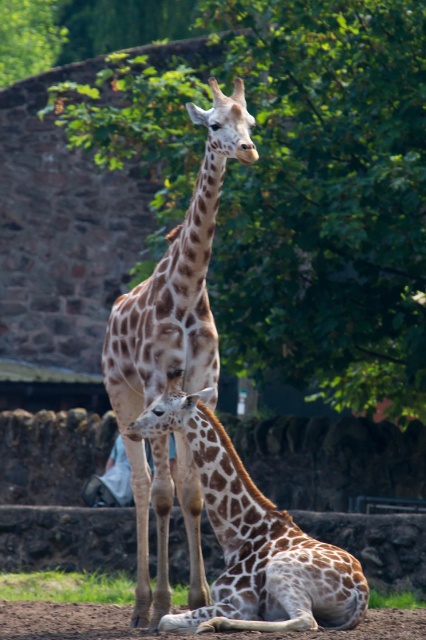
Is green leafy tree at upper center closer to camera compared to brown spotted giraffe at center?

That is False.

Is green leafy tree at upper center positioned behind brown spotted giraffe at center?

Yes, it is.

Identify the location of green leafy tree at upper center. (327, 198).

Looking at this image, does green leafy tree at upper center appear on the right side of spotted fur giraffe at center?

Correct, you'll find green leafy tree at upper center to the right of spotted fur giraffe at center.

Between point (164, 212) and point (143, 620), which one is positioned in front?

Positioned in front is point (143, 620).

Is point (169, 106) in front of point (183, 493)?

No.

The width and height of the screenshot is (426, 640). Identify the location of green leafy tree at upper center. (x=327, y=198).

Based on the photo, who is more forward, (253, 560) or (172, 637)?

Point (172, 637) is more forward.

Describe the element at coordinates (253, 538) in the screenshot. I see `brown spotted giraffe at center` at that location.

Describe the element at coordinates (253, 538) in the screenshot. The width and height of the screenshot is (426, 640). I see `brown spotted giraffe at center` at that location.

The image size is (426, 640). Identify the location of brown spotted giraffe at center. (253, 538).